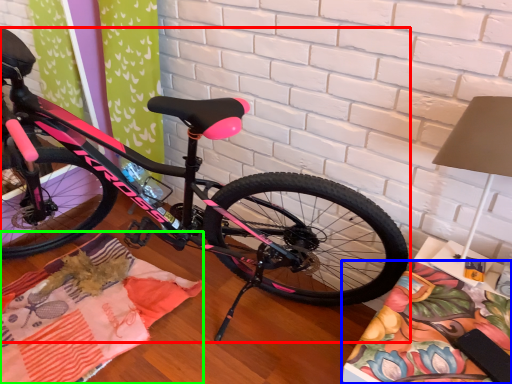
Question: Estimate the real-world distances between objects in this image. Which object is closer to bicycle (highlighted by a red box), blanket (highlighted by a blue box) or blanket (highlighted by a green box)?

Choices:
 (A) blanket
 (B) blanket

Answer: (B)